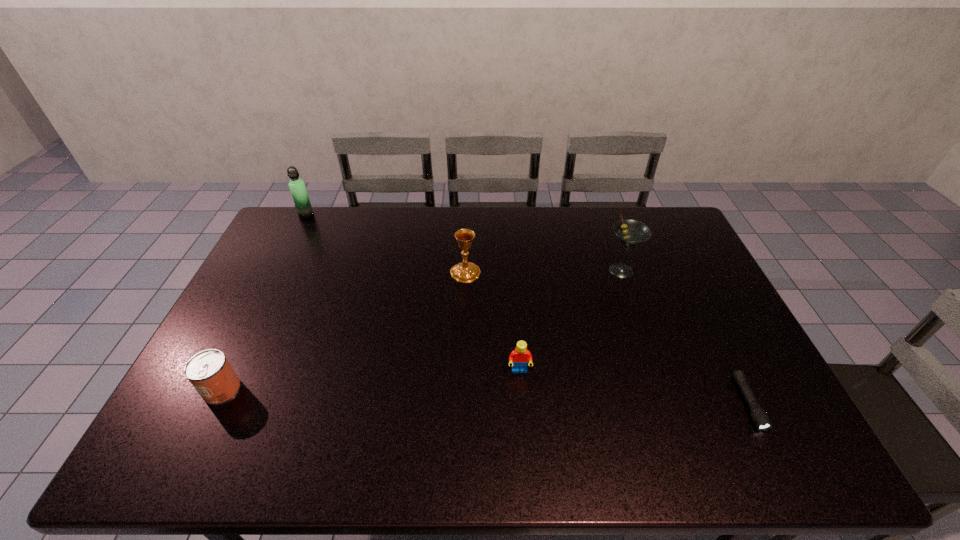
Image resolution: width=960 pixels, height=540 pixels. In the image, there is a desktop. In order to click on vacant space at the near edge in this screenshot , I will do `click(287, 453)`.

Where is `vacant space at the right edge of the desktop`? vacant space at the right edge of the desktop is located at coordinates (680, 306).

Where is `free area in between the farthest object and the third object from right to left`? This screenshot has width=960, height=540. free area in between the farthest object and the third object from right to left is located at coordinates (413, 293).

Identify the location of free area in between the third object from right to left and the farthest object. (413, 293).

Identify the location of free space between the third object from right to left and the fourth shortest object. (492, 321).

Where is `free space between the can and the fourth object from right to left`? The width and height of the screenshot is (960, 540). free space between the can and the fourth object from right to left is located at coordinates (344, 331).

This screenshot has height=540, width=960. Identify the location of vacant point located between the shortest object and the thermos bottle. (527, 309).

This screenshot has height=540, width=960. In order to click on vacant region between the can and the flashlight in this screenshot , I will do `click(485, 396)`.

Locate an element on the screen. unoccupied area between the can and the fourth object from left to right is located at coordinates (371, 380).

You are a GUI agent. You are given a task and a screenshot of the screen. Output one action in this format:
    pyautogui.click(x=<x>, y=<y>)
    Task: Click on the free area in between the third object from left to right and the can
    Image resolution: width=960 pixels, height=540 pixels.
    Given the screenshot: What is the action you would take?
    pyautogui.click(x=344, y=331)